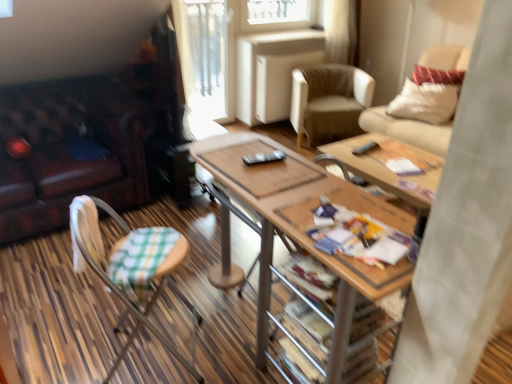
The height and width of the screenshot is (384, 512). In order to click on unoccupied region to the right of green checkered fabric chair at lower left, placed as the third chair when sorted from back to front in this screenshot , I will do `click(219, 352)`.